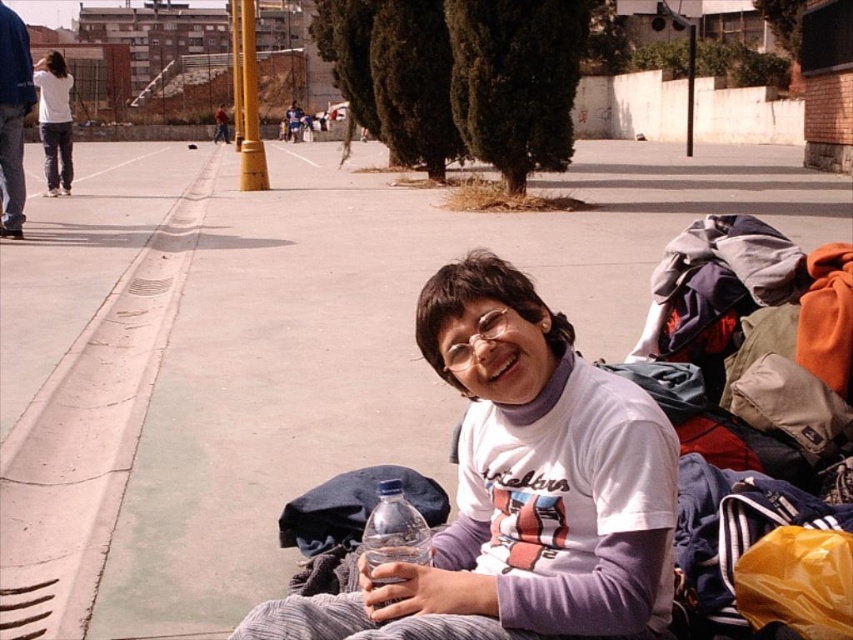
You are organizing a picnic and need to place the clear plastic bottle at lower center and the brown leather jacket at upper center in your backpack. Which item should you place first to ensure the taller one is at the bottom?

The brown leather jacket at upper center is taller than the clear plastic bottle at lower center, so you should place the brown leather jacket at upper center first at the bottom of the backpack.